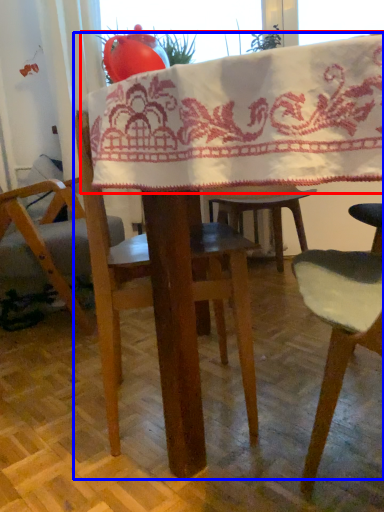
Question: Which object is further to the camera taking this photo, blanket (highlighted by a red box) or table (highlighted by a blue box)?

Choices:
 (A) blanket
 (B) table

Answer: (A)